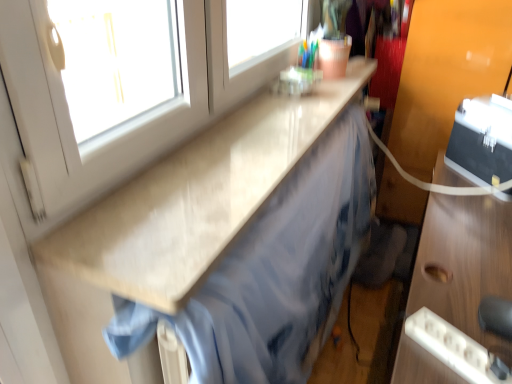
Question: Is light beige laminate countertop at upper center in contact with wooden desk at right?

Choices:
 (A) yes
 (B) no

Answer: (B)

Question: From the image's perspective, is light beige laminate countertop at upper center beneath wooden desk at right?

Choices:
 (A) no
 (B) yes

Answer: (A)

Question: Is the depth of light beige laminate countertop at upper center greater than that of wooden desk at right?

Choices:
 (A) yes
 (B) no

Answer: (A)

Question: From the image's perspective, is light beige laminate countertop at upper center located above wooden desk at right?

Choices:
 (A) no
 (B) yes

Answer: (B)

Question: Does light beige laminate countertop at upper center have a greater height compared to wooden desk at right?

Choices:
 (A) yes
 (B) no

Answer: (B)

Question: Considering the relative sizes of light beige laminate countertop at upper center and wooden desk at right in the image provided, is light beige laminate countertop at upper center bigger than wooden desk at right?

Choices:
 (A) yes
 (B) no

Answer: (B)

Question: Is light beige laminate countertop at upper center at the back of wooden desk at right?

Choices:
 (A) yes
 (B) no

Answer: (B)

Question: Is wooden desk at right in front of light beige laminate countertop at upper center?

Choices:
 (A) no
 (B) yes

Answer: (B)

Question: Would you say wooden desk at right is a long distance from light beige laminate countertop at upper center?

Choices:
 (A) yes
 (B) no

Answer: (B)

Question: Considering the relative sizes of wooden desk at right and light beige laminate countertop at upper center in the image provided, is wooden desk at right bigger than light beige laminate countertop at upper center?

Choices:
 (A) yes
 (B) no

Answer: (A)

Question: Could you tell me if wooden desk at right is facing light beige laminate countertop at upper center?

Choices:
 (A) yes
 (B) no

Answer: (B)

Question: From a real-world perspective, is wooden desk at right on light beige laminate countertop at upper center?

Choices:
 (A) no
 (B) yes

Answer: (A)

Question: Which is correct: wooden desk at right is inside light beige laminate countertop at upper center, or outside of it?

Choices:
 (A) inside
 (B) outside

Answer: (B)